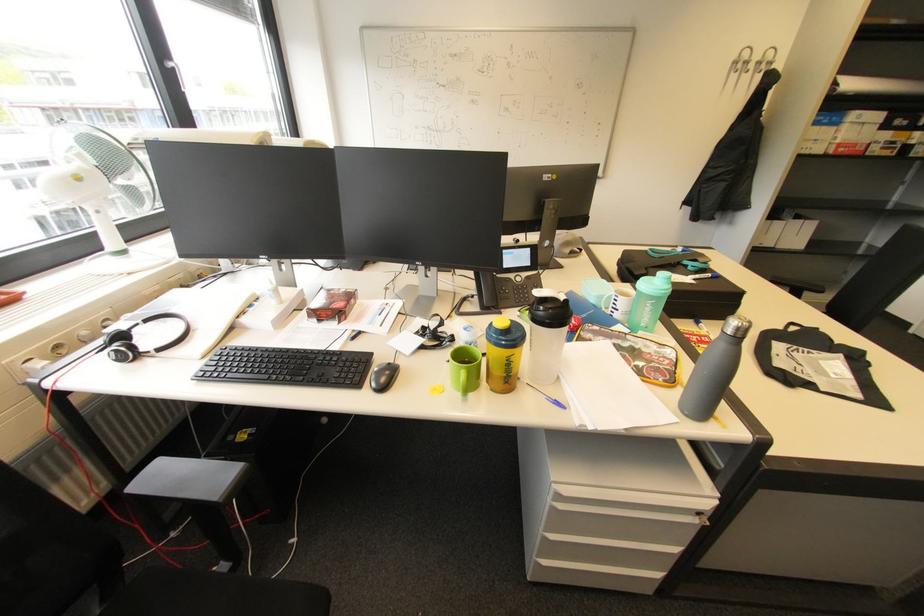
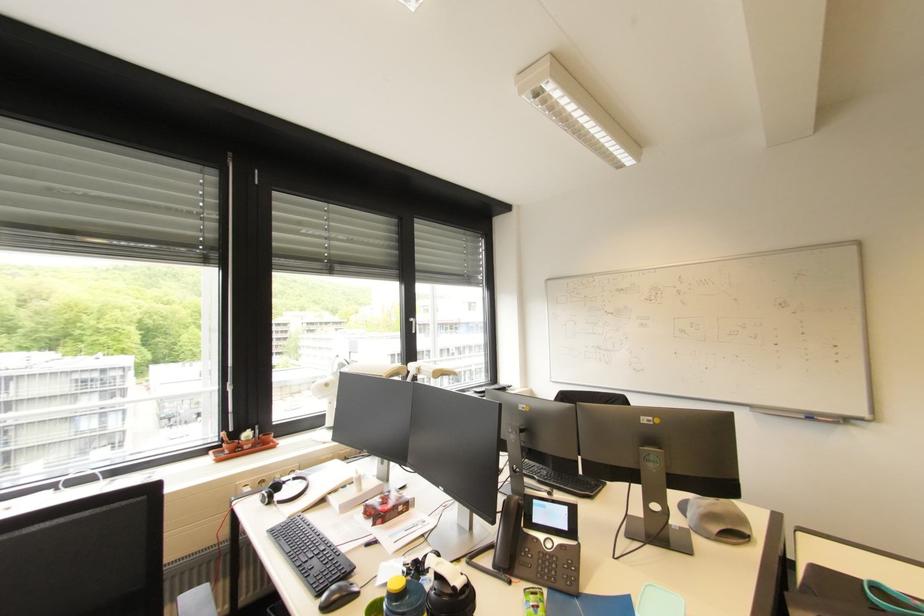
How did the camera likely rotate?

The rotation direction of the camera is left-up.